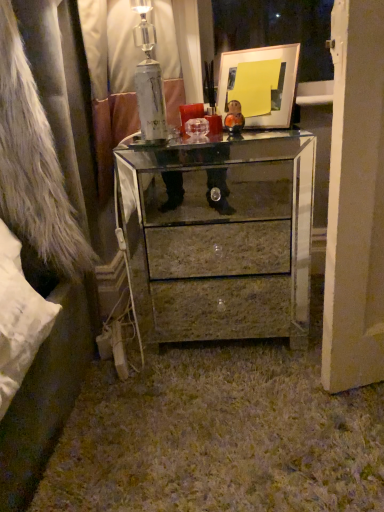
Question: Does brown marble drawer at center have a greater width compared to mirrored glass chest of drawers at center?

Choices:
 (A) no
 (B) yes

Answer: (A)

Question: Can mirrored glass chest of drawers at center be found inside brown marble drawer at center?

Choices:
 (A) yes
 (B) no

Answer: (B)

Question: From a real-world perspective, is brown marble drawer at center below mirrored glass chest of drawers at center?

Choices:
 (A) no
 (B) yes

Answer: (B)

Question: Can you confirm if brown marble drawer at center is positioned to the left of mirrored glass chest of drawers at center?

Choices:
 (A) yes
 (B) no

Answer: (B)

Question: Considering the relative sizes of brown marble drawer at center and mirrored glass chest of drawers at center in the image provided, is brown marble drawer at center taller than mirrored glass chest of drawers at center?

Choices:
 (A) no
 (B) yes

Answer: (A)

Question: In terms of width, does brown marble drawer at center look wider or thinner when compared to matte gold picture frame at upper center?

Choices:
 (A) wide
 (B) thin

Answer: (B)

Question: Considering the positions of brown marble drawer at center and matte gold picture frame at upper center in the image, is brown marble drawer at center taller or shorter than matte gold picture frame at upper center?

Choices:
 (A) short
 (B) tall

Answer: (A)

Question: Is point [203, 269] positioned closer to the camera than point [286, 72]?

Choices:
 (A) closer
 (B) farther

Answer: (B)

Question: From a real-world perspective, is brown marble drawer at center physically located above or below matte gold picture frame at upper center?

Choices:
 (A) below
 (B) above

Answer: (A)

Question: Considering the positions of matte gold picture frame at upper center and mirrored glass chest of drawers at center in the image, is matte gold picture frame at upper center bigger or smaller than mirrored glass chest of drawers at center?

Choices:
 (A) small
 (B) big

Answer: (A)

Question: Is matte gold picture frame at upper center inside or outside of mirrored glass chest of drawers at center?

Choices:
 (A) inside
 (B) outside

Answer: (B)

Question: Considering the positions of point (271, 103) and point (178, 254), is point (271, 103) closer or farther from the camera than point (178, 254)?

Choices:
 (A) closer
 (B) farther

Answer: (A)

Question: In terms of width, does matte gold picture frame at upper center look wider or thinner when compared to mirrored glass chest of drawers at center?

Choices:
 (A) wide
 (B) thin

Answer: (B)

Question: Considering the positions of mirrored glass chest of drawers at center and matte gold picture frame at upper center in the image, is mirrored glass chest of drawers at center taller or shorter than matte gold picture frame at upper center?

Choices:
 (A) short
 (B) tall

Answer: (B)

Question: Is point (x=144, y=253) positioned closer to the camera than point (x=278, y=100)?

Choices:
 (A) farther
 (B) closer

Answer: (A)